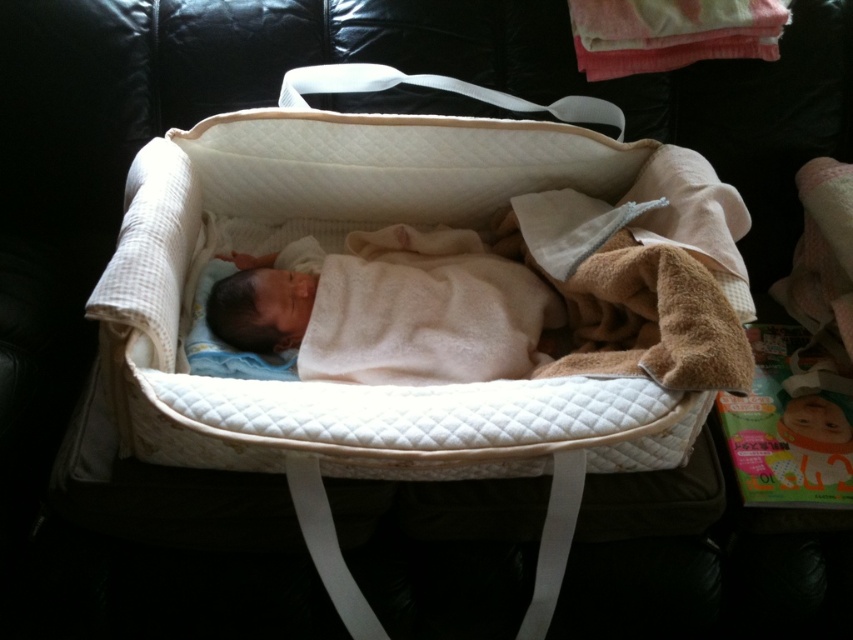
You are a parent holding a small stuffed animal toy. You want to place it on the surface where the baby is lying. Which object should you place it on, the white quilted mattress at center or the white soft blanket at center?

The white quilted mattress at center is taller than the white soft blanket at center, so you should place the stuffed animal toy on the white quilted mattress at center since it is higher and more stable.

You are holding a camera and want to take a photo of the baby in the portable bassinet. The camera has a focus range of 3 feet to 5 feet. Is the point at coordinates point (569, 168) within the camera focus range?

The point at coordinates point (569, 168) is 3.75 feet from the camera, which falls within the focus range of 3 to 5 feet. Therefore, the camera can focus on that point.

You are a caregiver who needs to ensure the baby is placed safely in the bassinet. Based on the image, is the white quilted mattress at center positioned correctly over the white soft blanket at center?

The white quilted mattress at center is above the white soft blanket at center, so the mattress is correctly positioned over the blanket, ensuring the baby has proper support and comfort.